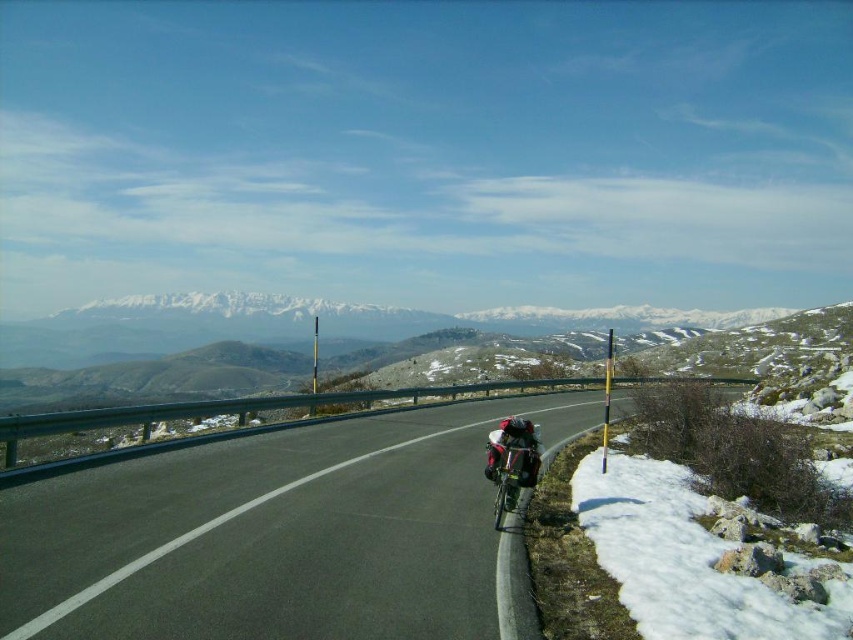
Between asphalt road at center and shiny metallic backpack at center, which one appears on the left side from the viewer's perspective?

asphalt road at center

Is point (244, 451) more distant than point (506, 438)?

Yes.

Where is `asphalt road at center`? This screenshot has width=853, height=640. asphalt road at center is located at coordinates (273, 536).

At what (x,y) coordinates should I click in order to perform the action: click on asphalt road at center. Please return your answer as a coordinate pair (x, y). Looking at the image, I should click on (273, 536).